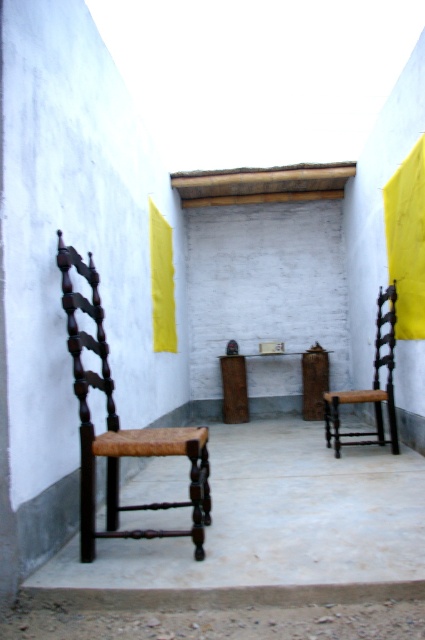
You are planning to place a large potted plant between the dark brown wood chair at left and the yellow fabric curtain at center. Considering their sizes, which object should the plant be closer to?

The dark brown wood chair at left has a larger size compared to the yellow fabric curtain at center, so the plant should be closer to the yellow fabric curtain at center to balance the space.

You are standing at point (x=155, y=300) and want to walk to point (x=413, y=236). Which direction should you move in to reach your destination?

You should move forward because point (x=413, y=236) is in front of point (x=155, y=300).

You are a maintenance worker needing to replace a curtain rod. You have a 6 feet long rod. You see the yellow fabric curtain at center hanging between the dark brown wood chair at right and another object. Will the rod fit between them?

The distance between the dark brown wood chair at right and the yellow fabric curtain at center is 5.82 feet. Since the rod is 6 feet long, it will fit as it is slightly longer than the space.